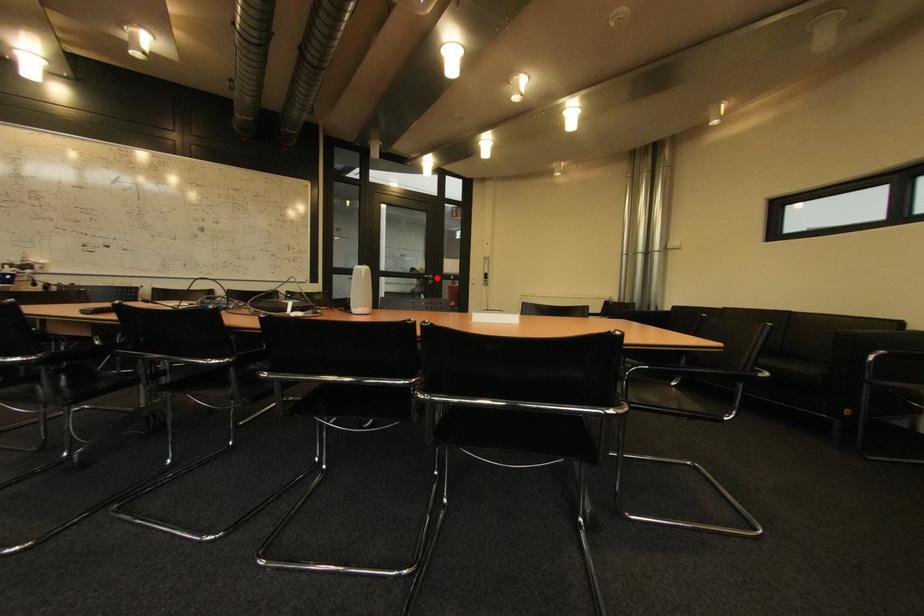
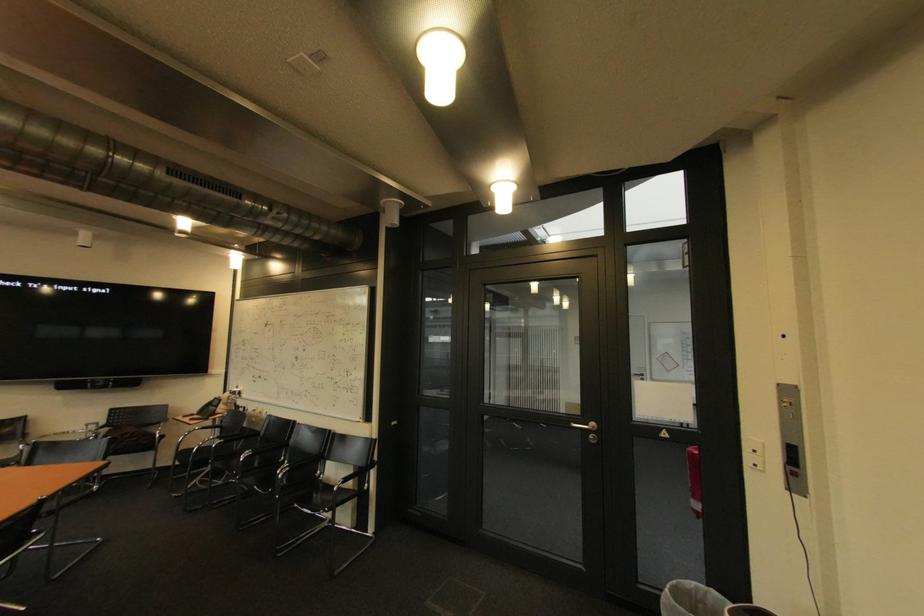
The point at the highlighted location is marked in the first image. Where is the corresponding point in the second image?

(596, 426)